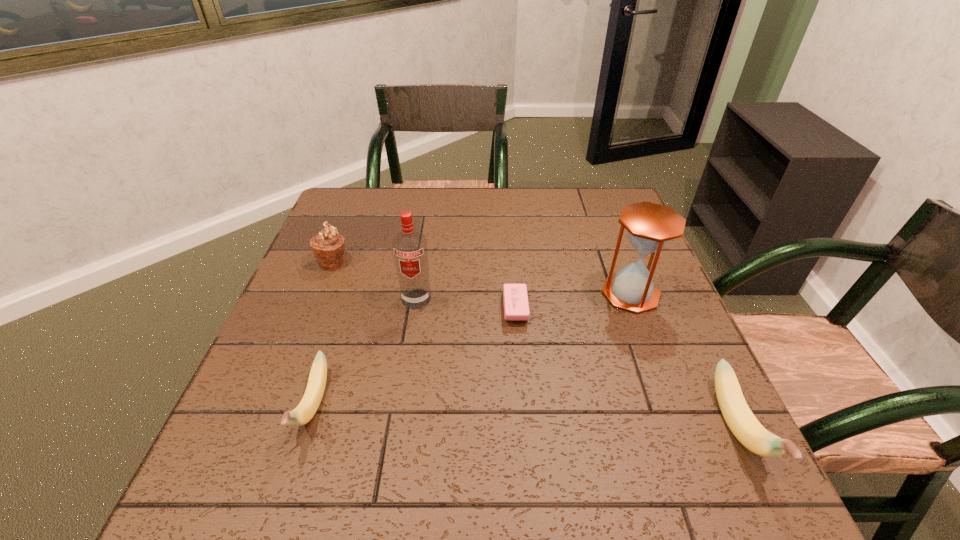
The height and width of the screenshot is (540, 960). I want to click on free spot between the fifth object from left to right and the muffin, so click(482, 278).

Find the location of a particular element. The width and height of the screenshot is (960, 540). free space between the eraser and the vodka is located at coordinates (466, 303).

The image size is (960, 540). I want to click on vacant area between the vodka and the taller banana, so click(x=577, y=363).

Where is `vacant area that lies between the fourth object from right to left and the shortest object`? The height and width of the screenshot is (540, 960). vacant area that lies between the fourth object from right to left and the shortest object is located at coordinates (466, 303).

This screenshot has height=540, width=960. Find the location of `blank region between the second shortest object and the fourth object from right to left`. blank region between the second shortest object and the fourth object from right to left is located at coordinates (365, 352).

Identify which object is the second nearest to the second shortest object. Please provide its 2D coordinates. Your answer should be formatted as a tuple, i.e. [(x, y)], where the tuple contains the x and y coordinates of a point satisfying the conditions above.

[(328, 246)]

Identify the location of object that stands as the fifth closest to the left banana. (743, 424).